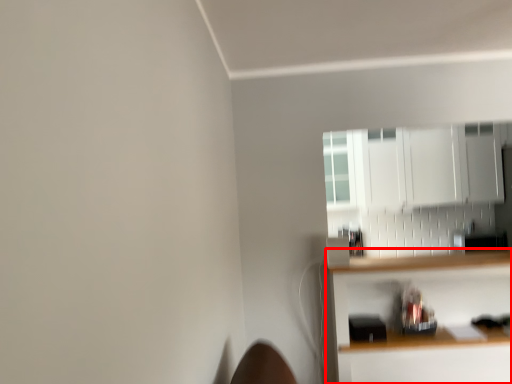
Question: From the image, what is the correct spatial relationship of shelf (annotated by the red box) in relation to cabinetry?

Choices:
 (A) right
 (B) left

Answer: (B)